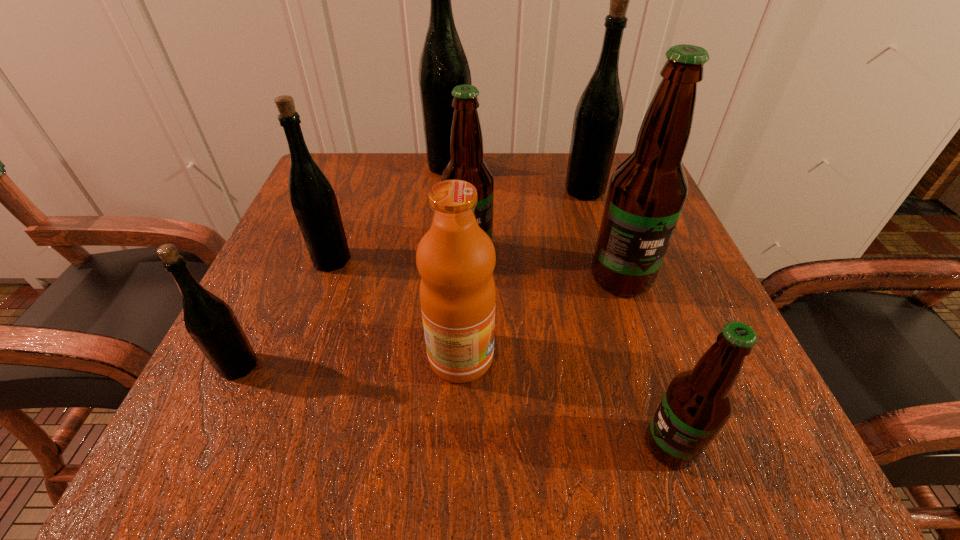
I want to click on the third closest green beer bottle to the nearest green beer bottle, so click(x=598, y=117).

Select which green beer bottle appears as the second closest to the second green beer bottle from right to left. Please provide its 2D coordinates. Your answer should be formatted as a tuple, i.e. [(x, y)], where the tuple contains the x and y coordinates of a point satisfying the conditions above.

[(313, 200)]

Identify which brown beer bottle is located as the third nearest to the sixth nearest beer bottle. Please provide its 2D coordinates. Your answer should be formatted as a tuple, i.e. [(x, y)], where the tuple contains the x and y coordinates of a point satisfying the conditions above.

[(698, 402)]

Identify which brown beer bottle is the second closest to the smallest brown beer bottle. Please provide its 2D coordinates. Your answer should be formatted as a tuple, i.e. [(x, y)], where the tuple contains the x and y coordinates of a point satisfying the conditions above.

[(466, 141)]